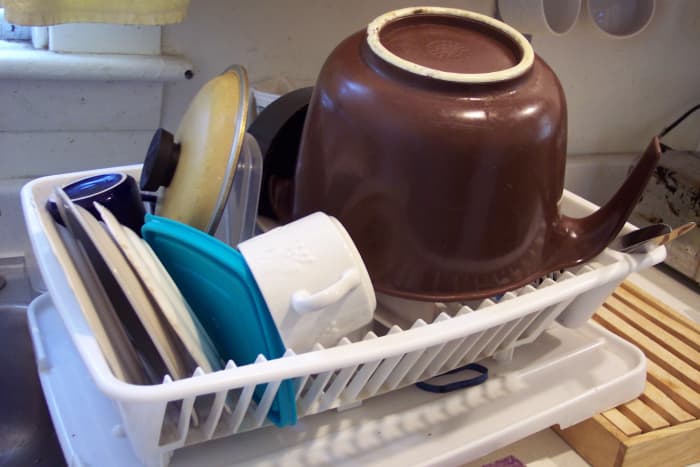
Identify the location of tupperware lid. Image resolution: width=700 pixels, height=467 pixels. (197, 265).